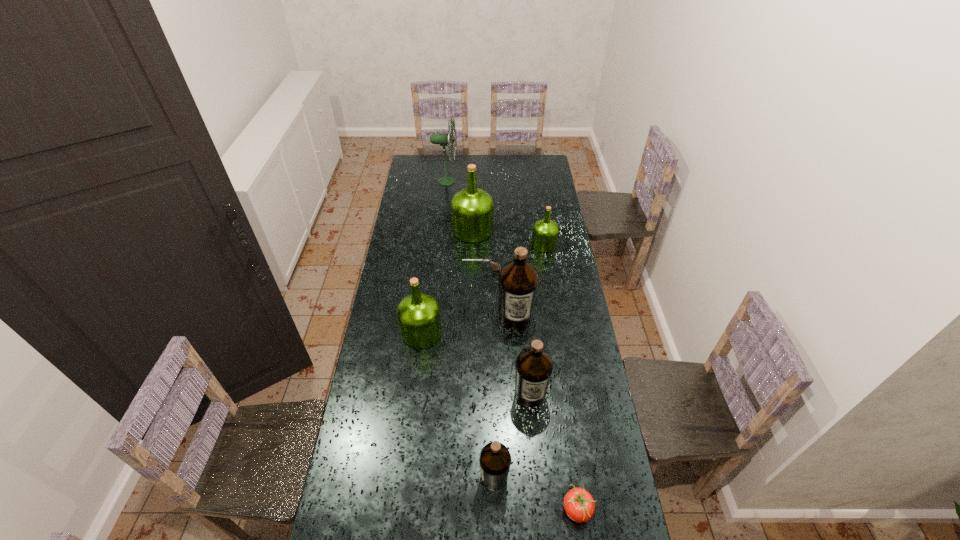
Find the location of a particular element. The height and width of the screenshot is (540, 960). green fan is located at coordinates (442, 139).

The height and width of the screenshot is (540, 960). I want to click on fan, so click(x=442, y=139).

I want to click on the biggest brown olive oil, so click(x=518, y=281).

The width and height of the screenshot is (960, 540). What are the coordinates of `the second green olive oil from right to left` in the screenshot? It's located at (472, 209).

Where is `the leftmost green olive oil`? This screenshot has height=540, width=960. the leftmost green olive oil is located at coordinates (418, 314).

Find the location of a particular element. This screenshot has width=960, height=540. the leftmost olive oil is located at coordinates (418, 314).

Find the location of a particular element. the second biggest brown olive oil is located at coordinates (534, 366).

The image size is (960, 540). What are the coordinates of `the fifth farthest olive oil` in the screenshot? It's located at (534, 366).

Identify the location of the rightmost olive oil. [x=545, y=232].

Find the location of `the rightmost green olive oil`. the rightmost green olive oil is located at coordinates (545, 232).